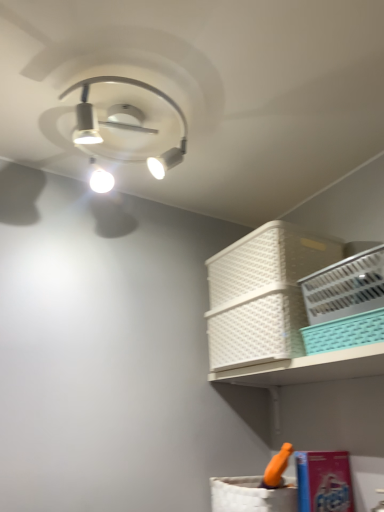
Question: Would you say white plastic basket at upper right, positioned as the 4th basket in front-to-back order, is to the left or to the right of white plastic basket at upper right, acting as the fourth basket starting from the back, in the picture?

Choices:
 (A) right
 (B) left

Answer: (B)

Question: Would you say white plastic basket at upper right, positioned as the 4th basket in front-to-back order, is inside or outside white plastic basket at upper right, acting as the fourth basket starting from the back?

Choices:
 (A) inside
 (B) outside

Answer: (B)

Question: Based on their relative distances, which object is farther from the white plastic basket at upper right, placed as the second basket when sorted from back to front?

Choices:
 (A) white plastic basket at upper right, marked as the first basket in a back-to-front arrangement
 (B) white plastic basket at upper right, acting as the fourth basket starting from the back
 (C) teal plastic basket at upper right, the second basket in the front-to-back sequence

Answer: (C)

Question: Considering the real-world distances, which object is farthest from the white plastic basket at upper right, positioned as the 4th basket in front-to-back order?

Choices:
 (A) white plastic basket at upper right, placed as the second basket when sorted from back to front
 (B) teal plastic basket at upper right, the second basket in the front-to-back sequence
 (C) white plastic basket at upper right, acting as the fourth basket starting from the back

Answer: (B)